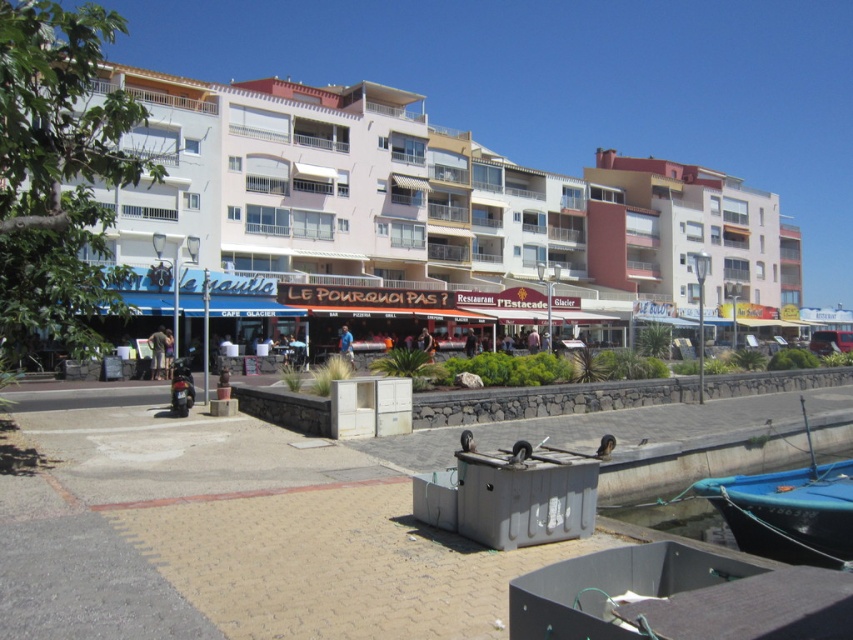
Question: Which point is farther from the camera taking this photo?

Choices:
 (A) (816, 561)
 (B) (149, 336)
 (C) (339, 346)
 (D) (688, 259)

Answer: (D)

Question: Can you confirm if white matte building at center is positioned below blue fabric shirt at center?

Choices:
 (A) no
 (B) yes

Answer: (A)

Question: In this image, where is white matte building at center located relative to light brown leather jacket at center?

Choices:
 (A) above
 (B) below

Answer: (A)

Question: Considering the real-world distances, which object is farthest from the blue fabric shirt at center?

Choices:
 (A) white matte building at center
 (B) teal glossy boat at lower right

Answer: (A)

Question: Can you confirm if teal glossy boat at lower right is positioned below light brown leather jacket at center?

Choices:
 (A) yes
 (B) no

Answer: (A)

Question: Estimate the real-world distances between objects in this image. Which object is closer to the white matte building at center?

Choices:
 (A) light brown leather jacket at center
 (B) teal glossy boat at lower right

Answer: (A)